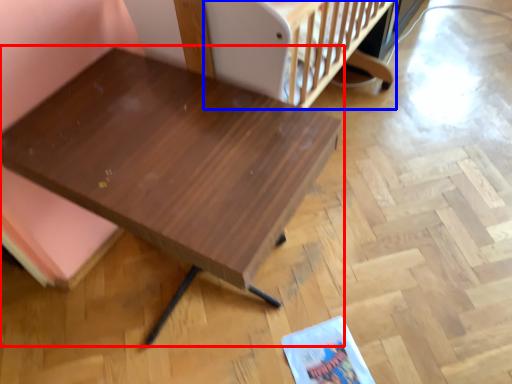
Question: Which object is closer to the camera taking this photo, table (highlighted by a red box) or infant bed (highlighted by a blue box)?

Choices:
 (A) table
 (B) infant bed

Answer: (A)